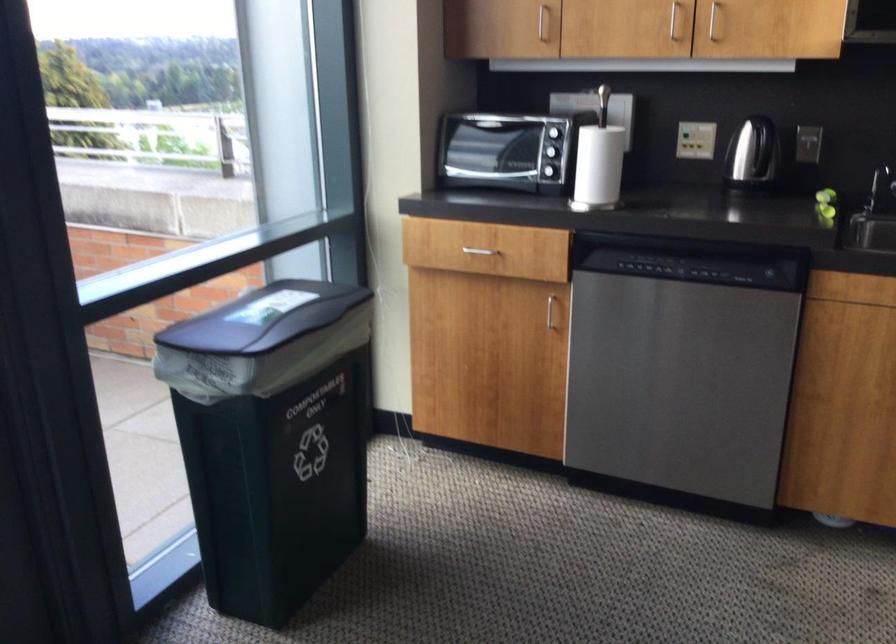
Identify the location of white light switch. (695, 140).